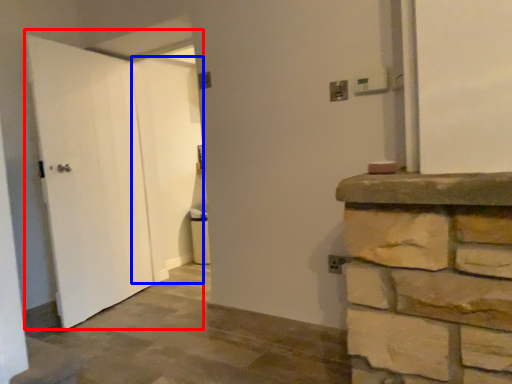
Question: Among these objects, which one is farthest to the camera, door (highlighted by a red box) or door (highlighted by a blue box)?

Choices:
 (A) door
 (B) door

Answer: (B)